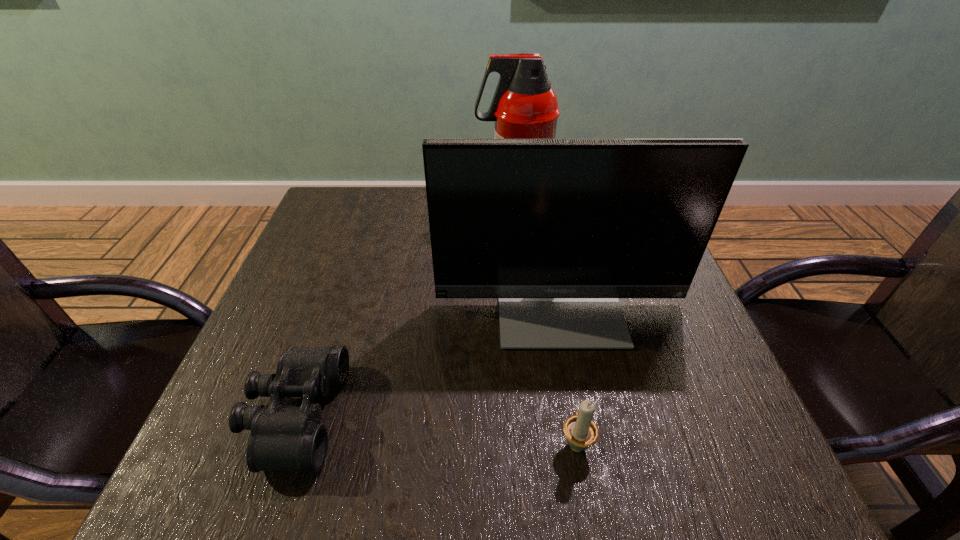
I want to click on vacant space at the near edge, so click(337, 460).

Identify the location of free spot at the right edge of the desktop. The width and height of the screenshot is (960, 540). (664, 365).

Identify the location of free region at the near left corner of the desktop. (221, 447).

The height and width of the screenshot is (540, 960). What are the coordinates of `free space between the third nearest object and the shortest object` in the screenshot? It's located at (426, 359).

Locate an element on the screen. vacant space that is in between the third nearest object and the third tallest object is located at coordinates (567, 373).

Locate an element on the screen. free space between the third tallest object and the binoculars is located at coordinates (436, 428).

The image size is (960, 540). Identify the location of object that is the second closest one to the leftmost object. (581, 432).

Find the location of a particular element. object that is the second closest one to the fire extinguisher is located at coordinates (283, 437).

Image resolution: width=960 pixels, height=540 pixels. Identify the location of vacant area that satisfies the following two spatial constraints: 1. on the trigger side of the fire extinguisher; 2. on the handle side of the third tallest object. (535, 442).

This screenshot has height=540, width=960. What are the coordinates of `free spot that satisfies the following two spatial constraints: 1. on the trigger side of the farthest object; 2. on the handle side of the candle_holder` in the screenshot? It's located at (535, 442).